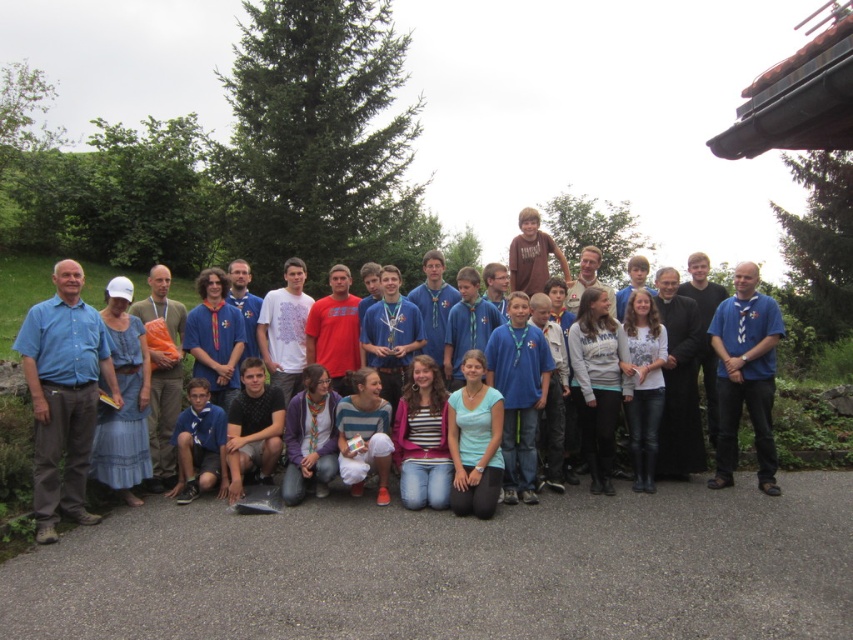
Measure the distance between blue cotton shirt at right and camera.

blue cotton shirt at right is 7.85 meters away from camera.

Consider the image. Who is higher up, blue cotton shirt at right or light blue cotton shirt at center?

blue cotton shirt at right is higher up.

Is point (738, 396) positioned in front of point (490, 452)?

No, (738, 396) is further to viewer.

The height and width of the screenshot is (640, 853). Identify the location of blue cotton shirt at right. (746, 376).

Does striped shirt at center appear on the left side of black cotton t-shirt at lower center?

In fact, striped shirt at center is to the right of black cotton t-shirt at lower center.

Which is below, striped shirt at center or black cotton t-shirt at lower center?

Positioned lower is black cotton t-shirt at lower center.

Which is in front, point (398, 403) or point (242, 490)?

Point (242, 490) is more forward.

You are a GUI agent. You are given a task and a screenshot of the screen. Output one action in this format:
    pyautogui.click(x=<x>, y=<y>)
    Task: Click on the striped shirt at center
    The height and width of the screenshot is (640, 853).
    Given the screenshot: What is the action you would take?
    pyautogui.click(x=422, y=438)

Can you confirm if purple fleece jacket at lower center is bigger than striped sweater at center?

Indeed, purple fleece jacket at lower center has a larger size compared to striped sweater at center.

This screenshot has height=640, width=853. Describe the element at coordinates (310, 436) in the screenshot. I see `purple fleece jacket at lower center` at that location.

Identify the location of purple fleece jacket at lower center. (310, 436).